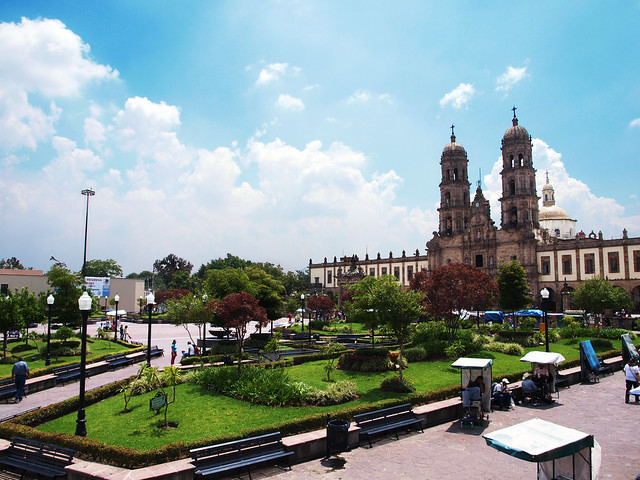
At what (x,y) coordinates should I click in order to perform the action: click on bench. Please return your answer as a coordinate pair (x, y). The image size is (640, 480). Looking at the image, I should click on (68, 373).